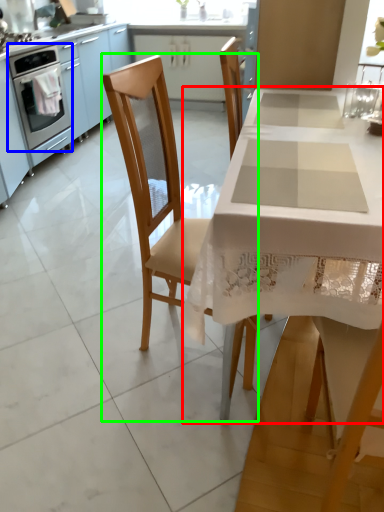
Question: Which object is positioned farthest from table (highlighted by a red box)? Select from home appliance (highlighted by a blue box) and chair (highlighted by a green box).

Choices:
 (A) home appliance
 (B) chair

Answer: (A)